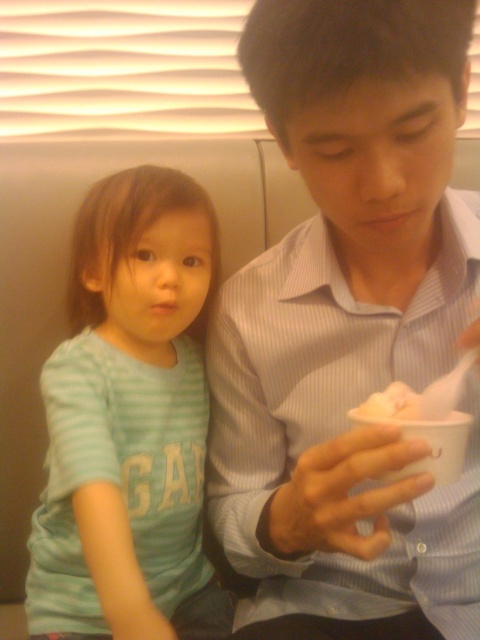
You are a photographer standing in front of the two people in the image. You want to take a clear photo of the matte blue shirt at center without the light blue striped shirt at left blocking it. Is this possible based on their current positions?

The matte blue shirt at center is in front of the light blue striped shirt at left, so taking a clear photo of the matte blue shirt at center without the light blue striped shirt at left blocking it is possible because the matte blue shirt at center is already positioned in front.

You are standing in front of the image and want to locate the light blue striped shirt at left. Where exactly is it positioned in the image?

The light blue striped shirt at left is positioned at point coordinates 0.662 on the x axis and 0.269 on the y axis.